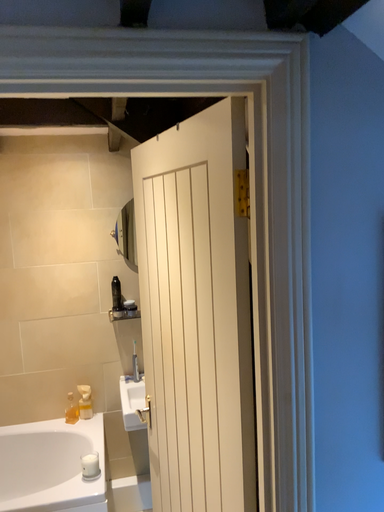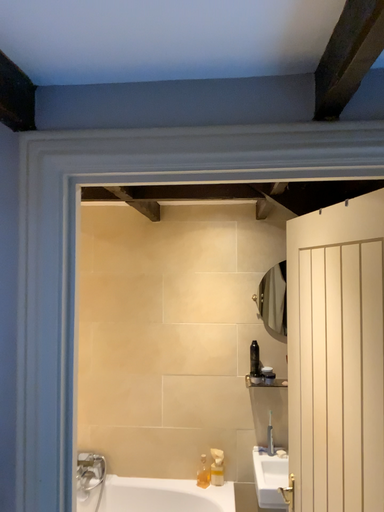
Question: How did the camera likely rotate when shooting the video?

Choices:
 (A) rotated left
 (B) rotated right

Answer: (A)